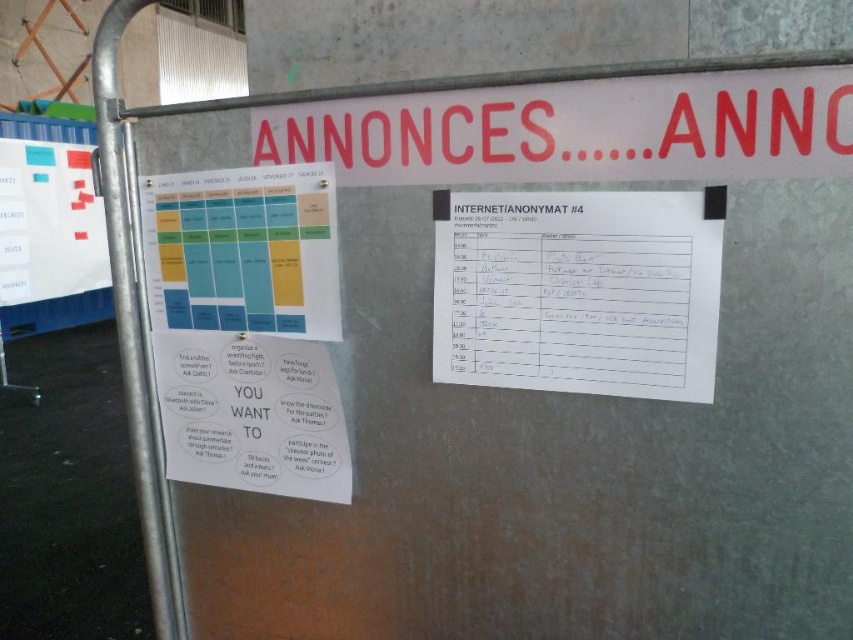
You are a student who needs to hang a new poster on the metal noticeboard. The poster is 4 inches wide. There is currently a white paper at upper right and a white paper sign at upper center. Can you place the poster between them without overlapping?

The white paper at upper right and white paper sign at upper center are 4.16 inches apart from each other. Since the poster is 4 inches wide, it can fit between them as the space is slightly larger than the poster.

You are a student who wants to check the schedule on the matte plastic calendar at center and the white paper with colorful stickers at left. Which one can you see more clearly?

The matte plastic calendar at center is closer to the viewer than the white paper with colorful stickers at left, so you can see the matte plastic calendar at center more clearly.